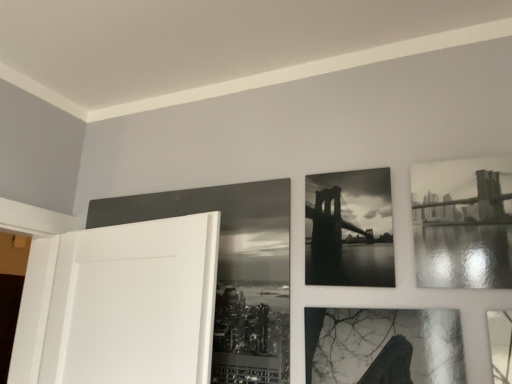
Locate an element on the screen. This screenshot has height=384, width=512. black glossy photo frame at center, which is the second picture frame in left-to-right order is located at coordinates (349, 229).

Is black glossy picture frame at upper center, positioned as the first picture frame in left-to-right order, further to camera compared to black glossy photo frame at upper right, which is the 1th picture frame in right-to-left order?

Yes, it is.

Is black glossy photo frame at upper right, which ranks as the 3th picture frame in left-to-right order, surrounded by black glossy picture frame at upper center, positioned as the first picture frame in left-to-right order?

Definitely not — black glossy photo frame at upper right, which ranks as the 3th picture frame in left-to-right order, is not inside black glossy picture frame at upper center, positioned as the first picture frame in left-to-right order.

Considering the sizes of objects black glossy picture frame at upper center, positioned as the first picture frame in left-to-right order, and black glossy photo frame at upper right, which is the 1th picture frame in right-to-left order, in the image provided, who is bigger, black glossy picture frame at upper center, positioned as the first picture frame in left-to-right order, or black glossy photo frame at upper right, which is the 1th picture frame in right-to-left order,?

Bigger between the two is black glossy picture frame at upper center, positioned as the first picture frame in left-to-right order.

Is black glossy photo frame at center, the 2th picture frame positioned from the right, wider or thinner than black glossy photo frame at upper right, which ranks as the 3th picture frame in left-to-right order?

black glossy photo frame at center, the 2th picture frame positioned from the right, is thinner than black glossy photo frame at upper right, which ranks as the 3th picture frame in left-to-right order.

Considering the points (362, 177) and (472, 278), which point is behind, point (362, 177) or point (472, 278)?

Point (362, 177)

How different are the orientations of black glossy photo frame at center, the 2th picture frame positioned from the right, and black glossy photo frame at upper right, which ranks as the 3th picture frame in left-to-right order, in degrees?

They differ by 0.0041 degrees in their facing directions.

From a real-world perspective, is black glossy photo frame at center, which is the second picture frame in left-to-right order, positioned above or below black glossy photo frame at upper right, which is the 1th picture frame in right-to-left order?

In terms of real-world spatial position, black glossy photo frame at center, which is the second picture frame in left-to-right order, is below black glossy photo frame at upper right, which is the 1th picture frame in right-to-left order.

Relative to black glossy picture frame at upper center, positioned as the first picture frame in left-to-right order, is black glossy photo frame at upper right, which is the 1th picture frame in right-to-left order, in front or behind?

black glossy photo frame at upper right, which is the 1th picture frame in right-to-left order, is in front of black glossy picture frame at upper center, positioned as the first picture frame in left-to-right order.

Is black glossy photo frame at upper right, which ranks as the 3th picture frame in left-to-right order, at the left side of black glossy picture frame at upper center, placed as the third picture frame when sorted from right to left?

No.

Is black glossy photo frame at upper right, which is the 1th picture frame in right-to-left order, not within black glossy picture frame at upper center, placed as the third picture frame when sorted from right to left?

Yes, black glossy photo frame at upper right, which is the 1th picture frame in right-to-left order, is not within black glossy picture frame at upper center, placed as the third picture frame when sorted from right to left.

Is black glossy picture frame at upper center, positioned as the first picture frame in left-to-right order, at the back of black glossy photo frame at upper right, which ranks as the 3th picture frame in left-to-right order?

No.

From a real-world perspective, which is physically above, black glossy photo frame at upper right, which ranks as the 3th picture frame in left-to-right order, or black glossy photo frame at center, which is the second picture frame in left-to-right order?

black glossy photo frame at upper right, which ranks as the 3th picture frame in left-to-right order.

Is point (421, 170) positioned before point (321, 225)?

Yes, it is in front of point (321, 225).

Is black glossy photo frame at upper right, which is the 1th picture frame in right-to-left order, spatially inside black glossy photo frame at center, which is the second picture frame in left-to-right order, or outside of it?

black glossy photo frame at upper right, which is the 1th picture frame in right-to-left order, is outside black glossy photo frame at center, which is the second picture frame in left-to-right order.

Is black glossy photo frame at upper right, which is the 1th picture frame in right-to-left order, taller or shorter than black glossy photo frame at center, the 2th picture frame positioned from the right?

black glossy photo frame at upper right, which is the 1th picture frame in right-to-left order, is shorter than black glossy photo frame at center, the 2th picture frame positioned from the right.

How distant is black glossy picture frame at upper center, placed as the third picture frame when sorted from right to left, from black glossy photo frame at center, which is the second picture frame in left-to-right order?

black glossy picture frame at upper center, placed as the third picture frame when sorted from right to left, and black glossy photo frame at center, which is the second picture frame in left-to-right order, are 9.19 inches apart from each other.

Is black glossy picture frame at upper center, positioned as the first picture frame in left-to-right order, touching black glossy photo frame at center, which is the second picture frame in left-to-right order?

They are not placed beside each other.

Who is shorter, black glossy picture frame at upper center, positioned as the first picture frame in left-to-right order, or black glossy photo frame at center, which is the second picture frame in left-to-right order?

Standing shorter between the two is black glossy photo frame at center, which is the second picture frame in left-to-right order.

Is black glossy picture frame at upper center, placed as the third picture frame when sorted from right to left, located outside black glossy photo frame at center, which is the second picture frame in left-to-right order?

That's correct, black glossy picture frame at upper center, placed as the third picture frame when sorted from right to left, is outside of black glossy photo frame at center, which is the second picture frame in left-to-right order.

Can we say black glossy photo frame at center, which is the second picture frame in left-to-right order, lies outside black glossy picture frame at upper center, positioned as the first picture frame in left-to-right order?

black glossy photo frame at center, which is the second picture frame in left-to-right order, is positioned outside black glossy picture frame at upper center, positioned as the first picture frame in left-to-right order.

Considering their positions, is black glossy photo frame at center, the 2th picture frame positioned from the right, located in front of or behind black glossy picture frame at upper center, positioned as the first picture frame in left-to-right order?

Clearly, black glossy photo frame at center, the 2th picture frame positioned from the right, is in front of black glossy picture frame at upper center, positioned as the first picture frame in left-to-right order.

Could you tell me if black glossy photo frame at center, which is the second picture frame in left-to-right order, is turned towards black glossy picture frame at upper center, placed as the third picture frame when sorted from right to left?

No, black glossy photo frame at center, which is the second picture frame in left-to-right order, is not facing towards black glossy picture frame at upper center, placed as the third picture frame when sorted from right to left.

From the image's perspective, relative to black glossy picture frame at upper center, placed as the third picture frame when sorted from right to left, is black glossy photo frame at center, the 2th picture frame positioned from the right, above or below?

black glossy photo frame at center, the 2th picture frame positioned from the right, is situated higher than black glossy picture frame at upper center, placed as the third picture frame when sorted from right to left, in the image.

Image resolution: width=512 pixels, height=384 pixels. What are the coordinates of `the 2nd picture frame above the black glossy picture frame at upper center, positioned as the first picture frame in left-to-right order (from the image's perspective)` in the screenshot? It's located at (463, 223).

This screenshot has height=384, width=512. What are the coordinates of `picture frame in front of the black glossy photo frame at center, the 2th picture frame positioned from the right` in the screenshot? It's located at (463, 223).

Considering their positions, is black glossy photo frame at upper right, which ranks as the 3th picture frame in left-to-right order, positioned further to black glossy photo frame at center, which is the second picture frame in left-to-right order, than black glossy picture frame at upper center, positioned as the first picture frame in left-to-right order?

The object further to black glossy photo frame at center, which is the second picture frame in left-to-right order, is black glossy picture frame at upper center, positioned as the first picture frame in left-to-right order.

Which object lies nearer to the anchor point black glossy picture frame at upper center, positioned as the first picture frame in left-to-right order, black glossy photo frame at center, the 2th picture frame positioned from the right, or black glossy photo frame at upper right, which ranks as the 3th picture frame in left-to-right order?

black glossy photo frame at center, the 2th picture frame positioned from the right.

Considering their positions, is black glossy picture frame at upper center, positioned as the first picture frame in left-to-right order, positioned further to black glossy photo frame at center, which is the second picture frame in left-to-right order, than black glossy photo frame at upper right, which is the 1th picture frame in right-to-left order?

The object further to black glossy photo frame at center, which is the second picture frame in left-to-right order, is black glossy picture frame at upper center, positioned as the first picture frame in left-to-right order.

Based on their spatial positions, is black glossy photo frame at center, which is the second picture frame in left-to-right order, or black glossy picture frame at upper center, positioned as the first picture frame in left-to-right order, further from black glossy photo frame at upper right, which is the 1th picture frame in right-to-left order?

black glossy picture frame at upper center, positioned as the first picture frame in left-to-right order, lies further to black glossy photo frame at upper right, which is the 1th picture frame in right-to-left order, than the other object.

Based on their spatial positions, is black glossy picture frame at upper center, placed as the third picture frame when sorted from right to left, or black glossy photo frame at center, which is the second picture frame in left-to-right order, further from black glossy photo frame at upper right, which ranks as the 3th picture frame in left-to-right order?

Based on the image, black glossy picture frame at upper center, placed as the third picture frame when sorted from right to left, appears to be further to black glossy photo frame at upper right, which ranks as the 3th picture frame in left-to-right order.

Estimate the real-world distances between objects in this image. Which object is further from black glossy picture frame at upper center, positioned as the first picture frame in left-to-right order, black glossy photo frame at upper right, which is the 1th picture frame in right-to-left order, or black glossy photo frame at center, which is the second picture frame in left-to-right order?

black glossy photo frame at upper right, which is the 1th picture frame in right-to-left order, lies further to black glossy picture frame at upper center, positioned as the first picture frame in left-to-right order, than the other object.

Identify the location of picture frame between black glossy picture frame at upper center, placed as the third picture frame when sorted from right to left, and black glossy photo frame at upper right, which ranks as the 3th picture frame in left-to-right order. (349, 229).